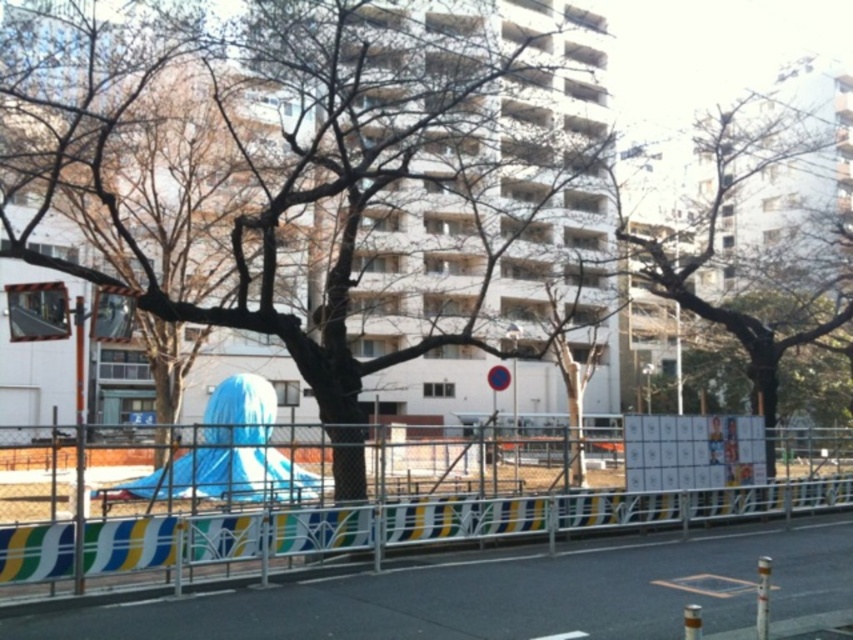
You are a delivery person trying to navigate through the area. You see the metallic silver fence at center and the bare wood tree at center. Which one is closer to you?

The metallic silver fence at center is closer to you because it is smaller than the bare wood tree at center, indicating it is nearer in the scene.

You are standing at the origin point of the image coordinate system. Where is the brown rough bark tree at center located in terms of coordinates?

The brown rough bark tree at center is located at coordinates point (328, 179).